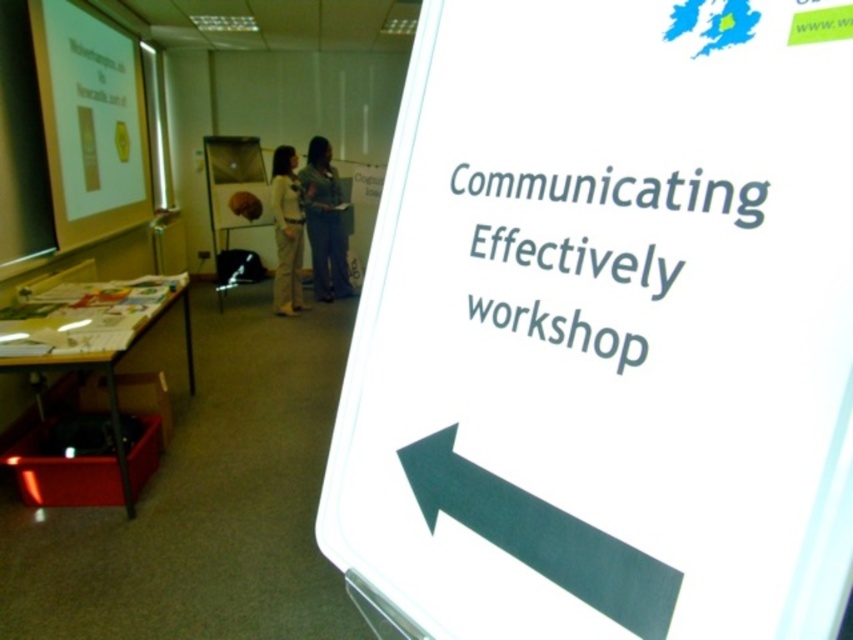
You are standing in the workshop and see the white glossy projector screen at upper left and the light beige pants at center. Which object is located to the left of the other?

The white glossy projector screen at upper left is positioned on the left side of light beige pants at center.